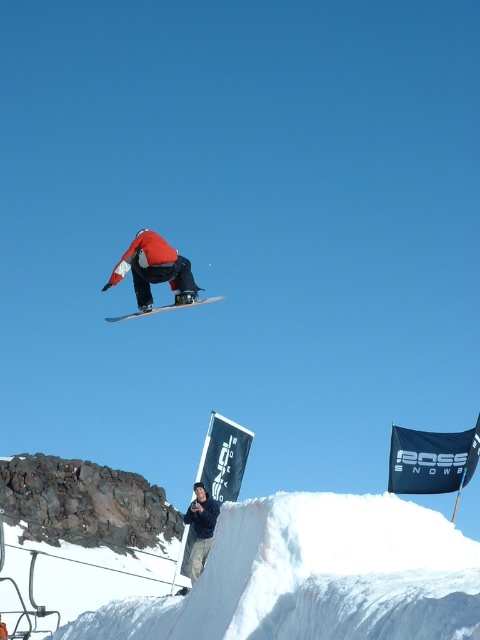
Does matte red snowboarder at center have a lesser height compared to white matte snowboard at center?

No.

Image resolution: width=480 pixels, height=640 pixels. In order to click on matte red snowboarder at center in this screenshot , I will do `click(155, 269)`.